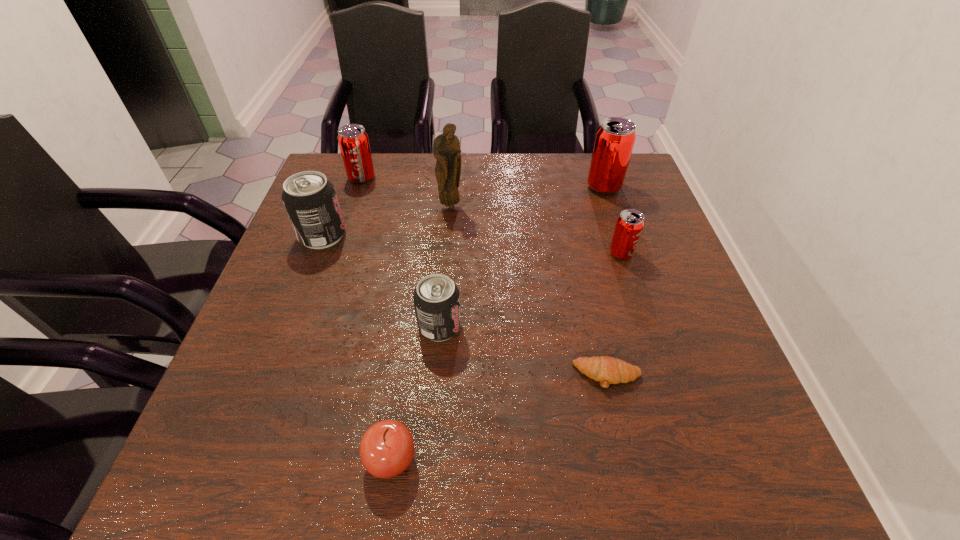
You are a GUI agent. You are given a task and a screenshot of the screen. Output one action in this format:
    pyautogui.click(x=<x>, y=<y>)
    Task: Click on the free region located 0.110m on the left of the seventh tallest object
    
    Given the screenshot: What is the action you would take?
    pyautogui.click(x=297, y=458)

This screenshot has height=540, width=960. In order to click on vacant space located 0.090m on the back of the second nearest object in this screenshot , I will do `click(595, 323)`.

Identify the location of object that is positioned at the near edge. (387, 448).

This screenshot has height=540, width=960. I want to click on object present at the far left corner, so click(x=353, y=140).

Where is `object at the far right corner`? object at the far right corner is located at coordinates (615, 138).

This screenshot has width=960, height=540. I want to click on free space at the far edge, so click(428, 161).

Find the location of `free point at the near edge`. free point at the near edge is located at coordinates (535, 444).

In the image, there is a desktop. Where is `vacant space at the left edge`? This screenshot has width=960, height=540. vacant space at the left edge is located at coordinates (345, 213).

Where is `free space at the right edge`? The image size is (960, 540). free space at the right edge is located at coordinates (692, 338).

Locate an element on the screen. This screenshot has width=960, height=540. vacant area at the far left corner of the desktop is located at coordinates (333, 178).